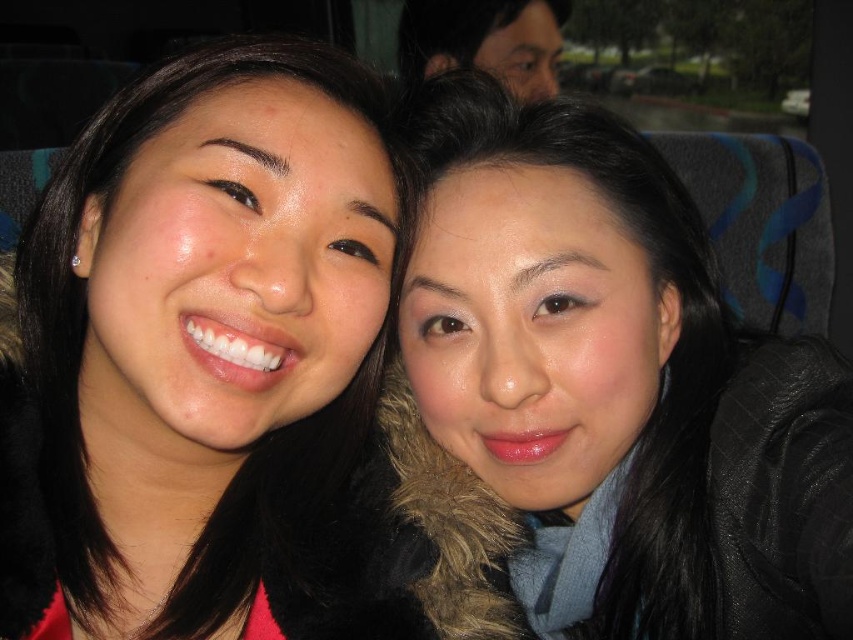
You are a photographer trying to capture a candid shot of the two people in the image. You notice the matte black jacket at center and the matte black hair at upper center. Which object is positioned lower in the frame?

The matte black jacket at center is positioned lower than the matte black hair at upper center in the frame.

You are a photographer trying to capture a group photo of the two people with matte black hair at center and matte black hair at upper center. The camera you are using has a minimum focusing distance of 2 meters. Will you be able to take a clear photo of both individuals at the same time?

The distance between the matte black hair at center and matte black hair at upper center is 1.98 meters. Since the minimum focusing distance of the camera is 2 meters, the photographer will not be able to capture both individuals clearly in the same frame as the distance is slightly less than required.

Consider the image. In the image, there are two people sitting close together in a vehicle. The person on the left has long dark hair and is wearing red, while the one on the right has long dark hair and a black jacket with a blue scarf. Where exactly is the matte black hair at center located in the image?

The matte black hair at center is located at point coordinates of (198, 352).